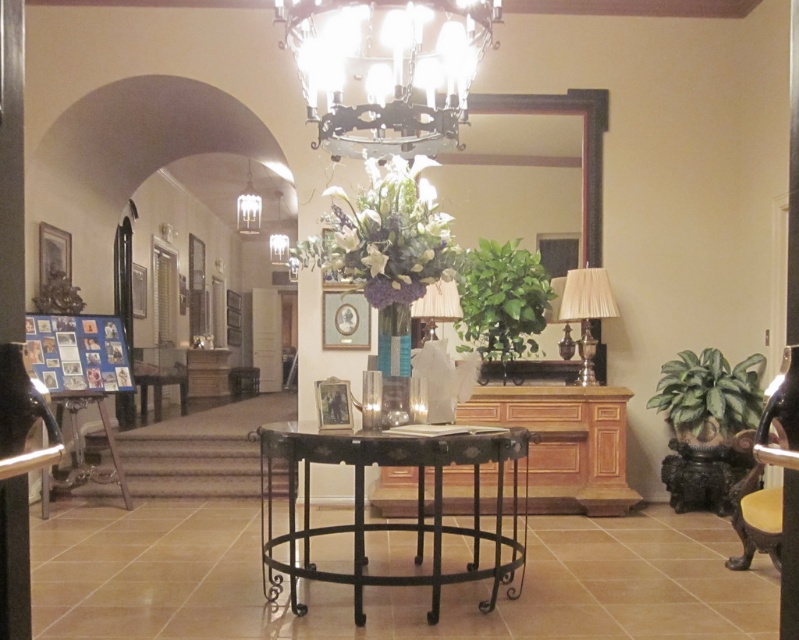
You are moving a white glossy vase at center and a yellow fabric armchair at right. Which object is placed higher in the scene?

The white glossy vase at center is positioned over the yellow fabric armchair at right, so it is placed higher.